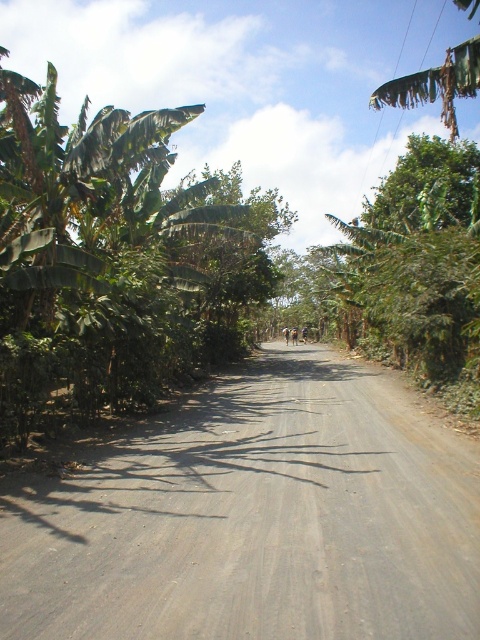
Question: Can you confirm if gray gravel road at center is bigger than green leafy tree at center?

Choices:
 (A) no
 (B) yes

Answer: (A)

Question: Which object is closer to the camera taking this photo?

Choices:
 (A) green leafy tree at center
 (B) green leafy banana tree at left
 (C) gray gravel road at center

Answer: (C)

Question: Among these points, which one is farthest from the camera?

Choices:
 (A) (158, 612)
 (B) (110, 132)

Answer: (B)

Question: Which object is positioned farthest from the green leafy tree at center?

Choices:
 (A) gray gravel road at center
 (B) green leafy banana tree at left

Answer: (A)

Question: Is gray gravel road at center to the left of green leafy tree at center from the viewer's perspective?

Choices:
 (A) no
 (B) yes

Answer: (B)

Question: In this image, where is gray gravel road at center located relative to green leafy banana tree at left?

Choices:
 (A) above
 (B) below

Answer: (B)